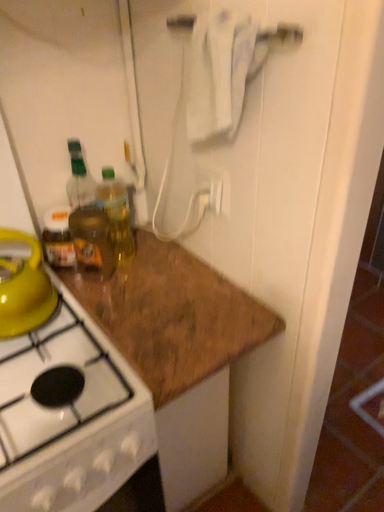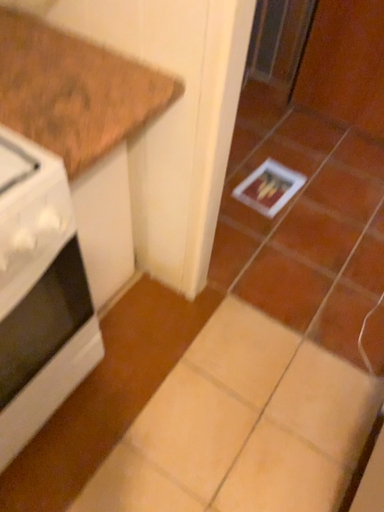
Question: Which way did the camera rotate in the video?

Choices:
 (A) rotated downward
 (B) rotated upward

Answer: (A)